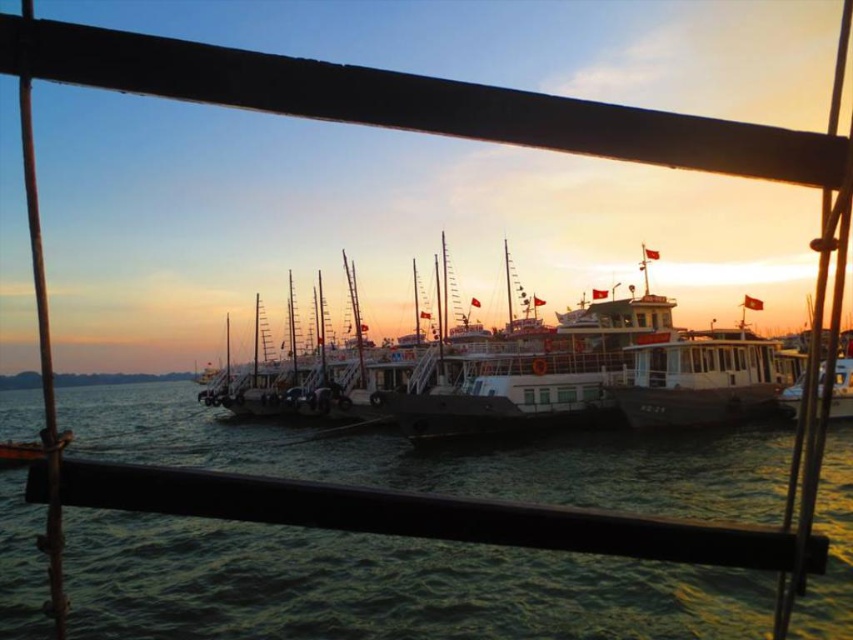
Question: Which point is closer to the camera?

Choices:
 (A) white matte boat at center
 (B) green water at center

Answer: (B)

Question: Is green water at center smaller than white matte boat at center?

Choices:
 (A) no
 (B) yes

Answer: (A)

Question: Is green water at center closer to the viewer compared to white matte boat at center?

Choices:
 (A) yes
 (B) no

Answer: (A)

Question: Among these points, which one is nearest to the camera?

Choices:
 (A) (799, 364)
 (B) (509, 461)

Answer: (B)

Question: Is the position of green water at center less distant than that of white matte boat at center?

Choices:
 (A) no
 (B) yes

Answer: (B)